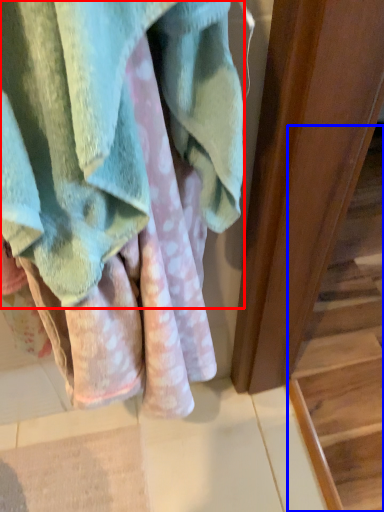
Question: Which object is further to the camera taking this photo, towel (highlighted by a red box) or stairwell (highlighted by a blue box)?

Choices:
 (A) towel
 (B) stairwell

Answer: (B)